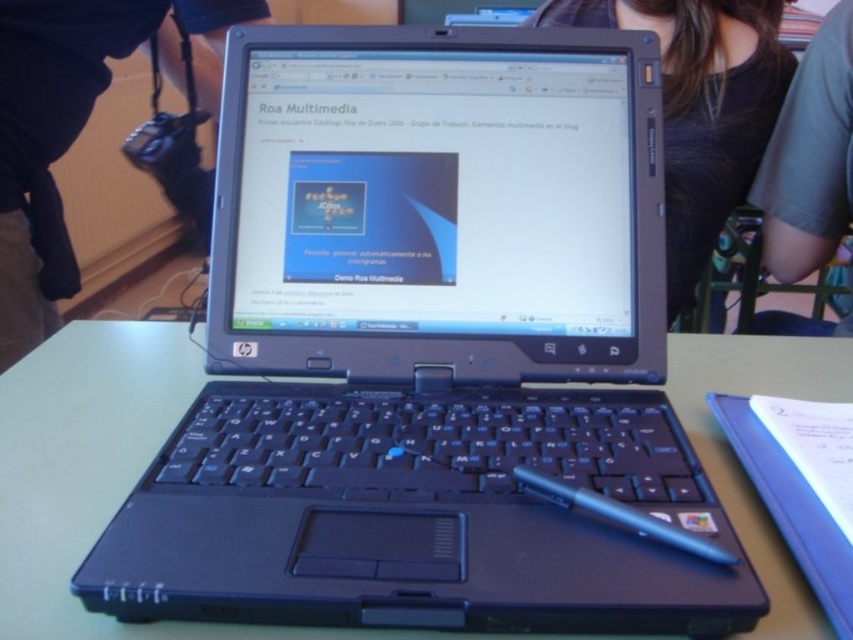
Question: Is green matte table at center above black plastic laptop at center?

Choices:
 (A) no
 (B) yes

Answer: (A)

Question: Estimate the real-world distances between objects in this image. Which object is closer to the black plastic laptop at center?

Choices:
 (A) green matte table at center
 (B) blue plastic pen at center

Answer: (A)

Question: Can you confirm if green matte table at center is wider than blue plastic pen at center?

Choices:
 (A) no
 (B) yes

Answer: (B)

Question: Is the position of green matte table at center less distant than that of black plastic laptop at center?

Choices:
 (A) no
 (B) yes

Answer: (B)

Question: Among these objects, which one is farthest from the camera?

Choices:
 (A) blue plastic pen at center
 (B) green matte table at center

Answer: (A)

Question: Among these points, which one is farthest from the camera?

Choices:
 (A) (44, 438)
 (B) (9, 273)
 (C) (599, 508)

Answer: (B)